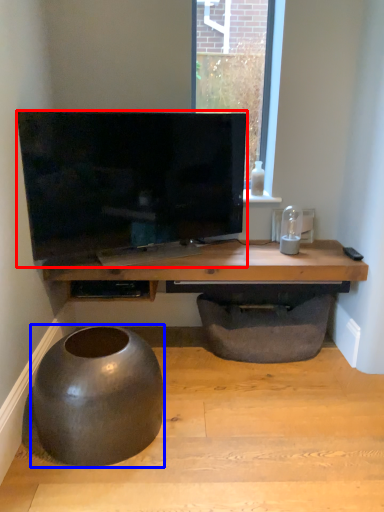
Question: Which object appears farthest to the camera in this image, television (highlighted by a red box) or round table (highlighted by a blue box)?

Choices:
 (A) television
 (B) round table

Answer: (A)